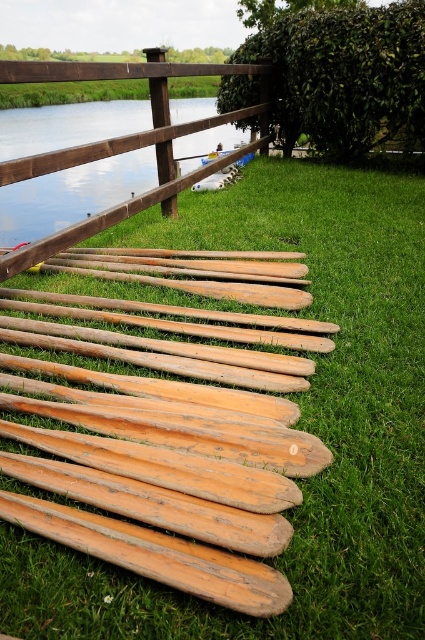
You are planning to place a small garden statue that is 1 meter tall in the scene. Given the green leafy hedge at upper center and the wooden canoe at center, which object would be a better reference point to ensure the statue fits proportionally?

The green leafy hedge at upper center is smaller than the wooden canoe at center, so the statue should be placed near the green leafy hedge at upper center to maintain proportional scaling.

You are planning to place a new bench between the green leafy hedge at upper center and the wooden canoe at center. Based on their widths, which object should the bench be closer to?

The green leafy hedge at upper center has a smaller width than the wooden canoe at center, so the bench should be placed closer to the green leafy hedge at upper center to ensure proper spacing between them.